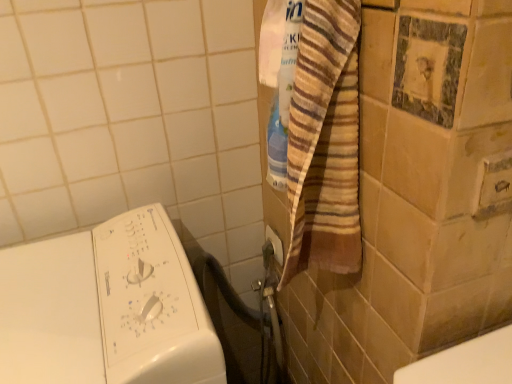
Question: In the image, is metallic silver plug at lower center positioned in front of or behind white glossy washing machine at upper left?

Choices:
 (A) front
 (B) behind

Answer: (B)

Question: In terms of height, does metallic silver plug at lower center look taller or shorter compared to white glossy washing machine at upper left?

Choices:
 (A) tall
 (B) short

Answer: (B)

Question: Is metallic silver plug at lower center situated inside white glossy washing machine at upper left or outside?

Choices:
 (A) inside
 (B) outside

Answer: (B)

Question: Is white glossy washing machine at upper left to the left or to the right of metallic silver plug at lower center in the image?

Choices:
 (A) right
 (B) left

Answer: (B)

Question: Is white glossy washing machine at upper left spatially inside metallic silver plug at lower center, or outside of it?

Choices:
 (A) inside
 (B) outside

Answer: (B)

Question: Considering the positions of white glossy washing machine at upper left and metallic silver plug at lower center in the image, is white glossy washing machine at upper left wider or thinner than metallic silver plug at lower center?

Choices:
 (A) wide
 (B) thin

Answer: (A)

Question: From a real-world perspective, is white glossy washing machine at upper left positioned above or below metallic silver plug at lower center?

Choices:
 (A) above
 (B) below

Answer: (B)